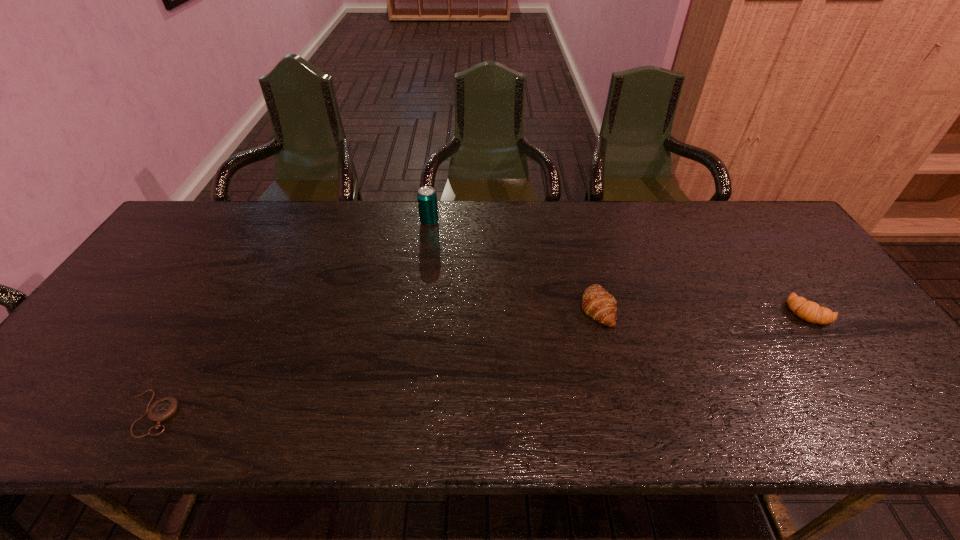
What are the coordinates of `free space located on the left of the shorter crescent roll` in the screenshot? It's located at (704, 312).

Where is `vacant area situated 0.170m on the right of the shortest object`? Image resolution: width=960 pixels, height=540 pixels. vacant area situated 0.170m on the right of the shortest object is located at coordinates (256, 413).

Identify the location of object located at the far edge. The height and width of the screenshot is (540, 960). (427, 198).

The image size is (960, 540). In order to click on object positioned at the near edge in this screenshot , I will do `click(163, 409)`.

Locate an element on the screen. object situated at the right edge is located at coordinates (809, 311).

Find the location of a particular element. vacant region at the far edge is located at coordinates (392, 212).

This screenshot has height=540, width=960. Identify the location of free space at the near edge of the desktop. (195, 435).

In the image, there is a desktop. Where is `vacant space at the left edge`? The height and width of the screenshot is (540, 960). vacant space at the left edge is located at coordinates (122, 343).

This screenshot has height=540, width=960. I want to click on free space at the right edge of the desktop, so click(x=828, y=295).

I want to click on free space between the second object from left to right and the nearest object, so click(290, 317).